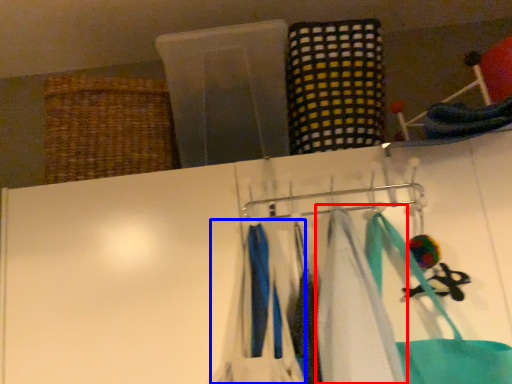
Question: Which object is further to the camera taking this photo, towel (highlighted by a red box) or clothing (highlighted by a blue box)?

Choices:
 (A) towel
 (B) clothing

Answer: (B)